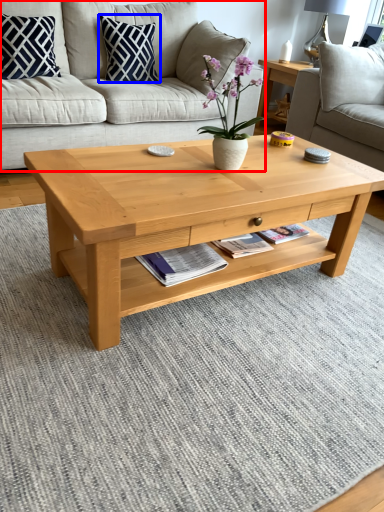
Question: Which of the following is the farthest to the observer, studio couch (highlighted by a red box) or pillow (highlighted by a blue box)?

Choices:
 (A) studio couch
 (B) pillow

Answer: (B)